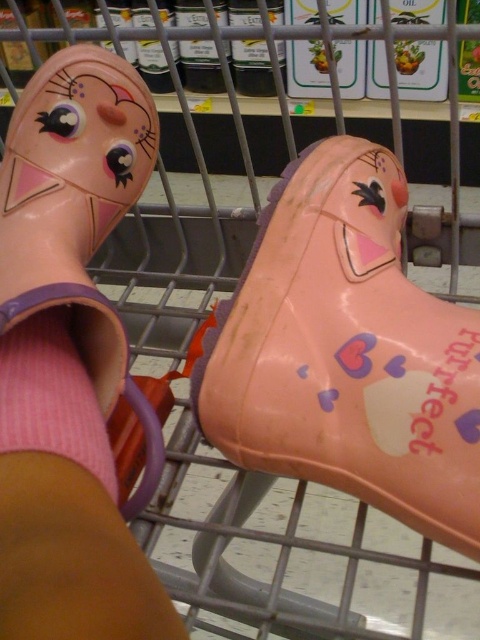
You are trying to fit both the pink rubber boot at center and the matte pink rubber boot at upper left into a narrow storage box. Based on their positions in the image, which boot should you try to place first?

The pink rubber boot at center is wider than the matte pink rubber boot at upper left, so you should place the wider pink rubber boot at center first to ensure it fits in the narrow storage box.

You are a parent trying to choose between the rubber boot at lower left and the pink knitted sock at lower left for your child. Based on their height, which one would you choose if you want something that covers more of the leg?

The rubber boot at lower left is much taller than the pink knitted sock at lower left, so you should choose the rubber boot at lower left for better leg coverage.

You are a customer in a store looking at the shopping cart. Where is the pink rubber boot at center located in the image?

The pink rubber boot at center is located at point [347,353] in the image.